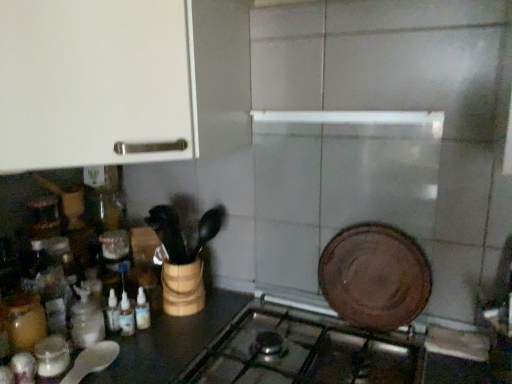
Question: Considering the positions of metallic silver gas stove at center and translucent glass bottles at lower left, acting as the third bottle starting from the left, in the image, is metallic silver gas stove at center bigger or smaller than translucent glass bottles at lower left, acting as the third bottle starting from the left,?

Choices:
 (A) big
 (B) small

Answer: (A)

Question: Based on their positions, is metallic silver gas stove at center located to the left or right of translucent glass bottles at lower left, acting as the third bottle starting from the left?

Choices:
 (A) left
 (B) right

Answer: (B)

Question: Estimate the real-world distances between objects in this image. Which object is farther from the metallic silver gas stove at center?

Choices:
 (A) translucent glass jar at left, which appears as the 1th bottle when viewed from the left
 (B) translucent glass bottles at lower left, acting as the third bottle starting from the left
 (C) white matte cabinet at upper left
 (D) brown matte plate at upper right
 (E) translucent glass bottle at lower left, which ranks as the 2th bottle in left-to-right order

Answer: (C)

Question: Estimate the real-world distances between objects in this image. Which object is closer to the translucent glass bottles at lower left, acting as the third bottle starting from the left?

Choices:
 (A) metallic silver gas stove at center
 (B) brown matte plate at upper right
 (C) white matte cabinet at upper left
 (D) translucent glass bottle at lower left, which ranks as the 2th bottle in left-to-right order
 (E) translucent glass jar at left, marked as the 3th bottle in a right-to-left arrangement

Answer: (D)